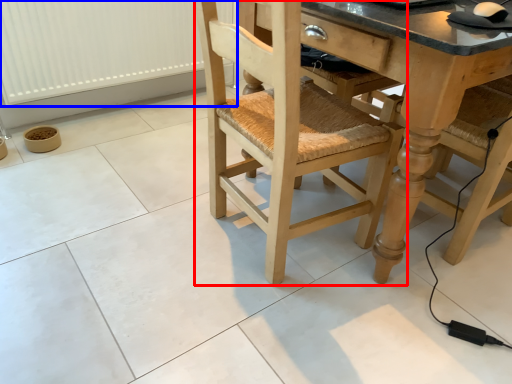
Question: Which point is closer to the camera, chair (highlighted by a red box) or radiator (highlighted by a blue box)?

Choices:
 (A) chair
 (B) radiator

Answer: (A)